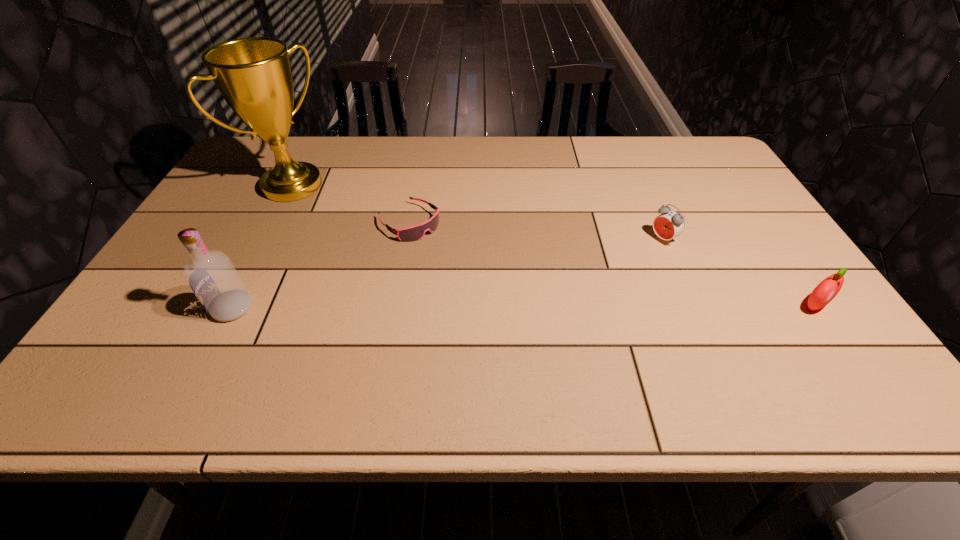
This screenshot has height=540, width=960. I want to click on vacant space located on the front-facing side of the shortest object, so click(513, 307).

Find the location of a particular element. The width and height of the screenshot is (960, 540). vacant space located on the front-facing side of the shortest object is located at coordinates (513, 307).

You are a GUI agent. You are given a task and a screenshot of the screen. Output one action in this format:
    pyautogui.click(x=<x>, y=<y>)
    Task: Click on the free spot located 0.290m on the face of the alarm clock
    The height and width of the screenshot is (540, 960).
    Given the screenshot: What is the action you would take?
    pyautogui.click(x=574, y=293)

Image resolution: width=960 pixels, height=540 pixels. I want to click on blank area located on the face of the alarm clock, so click(601, 277).

Identify the location of vacant space located on the face of the alarm clock. The height and width of the screenshot is (540, 960). (615, 268).

The width and height of the screenshot is (960, 540). Find the location of `free space located 0.070m by the handles of the award`. free space located 0.070m by the handles of the award is located at coordinates (327, 212).

The width and height of the screenshot is (960, 540). What are the coordinates of `vacant space located by the handles of the award` in the screenshot? It's located at (405, 262).

In order to click on free space located 0.060m by the handles of the award in this screenshot , I will do `click(325, 210)`.

You are a GUI agent. You are given a task and a screenshot of the screen. Output one action in this format:
    pyautogui.click(x=<x>, y=<y>)
    Task: Click on the object situated at the far edge
    The width and height of the screenshot is (960, 540).
    Given the screenshot: What is the action you would take?
    pyautogui.click(x=253, y=74)

Identify the location of object at the near edge. (211, 275).